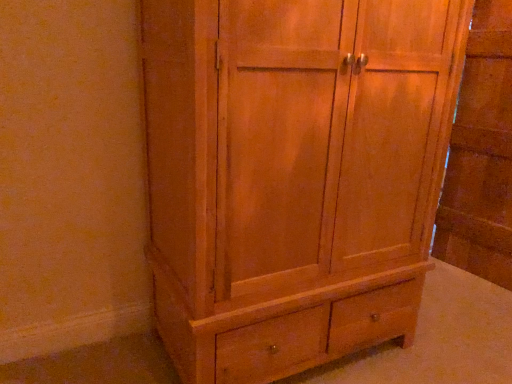
Describe the element at coordinates (481, 154) in the screenshot. I see `natural wood cabinet at right` at that location.

This screenshot has width=512, height=384. I want to click on natural wood cabinet at right, so click(x=481, y=154).

What do you see at coordinates (293, 175) in the screenshot? The width and height of the screenshot is (512, 384). I see `natural wood cupboard at center` at bounding box center [293, 175].

Identify the location of natural wood cupboard at center. The width and height of the screenshot is (512, 384). (293, 175).

At what (x,y) coordinates should I click in order to perform the action: click on natural wood cabinet at right. Please return your answer as a coordinate pair (x, y). Looking at the image, I should click on (481, 154).

Would you say natural wood cupboard at center is to the left or to the right of natural wood cabinet at right in the picture?

From the image, it's evident that natural wood cupboard at center is to the left of natural wood cabinet at right.

Which object is further away from the camera, natural wood cupboard at center or natural wood cabinet at right?

Positioned behind is natural wood cabinet at right.

Which is behind, point (251, 219) or point (466, 83)?

The point (466, 83) is behind.

From the image's perspective, who appears lower, natural wood cupboard at center or natural wood cabinet at right?

From the image's view, natural wood cupboard at center is below.

Based on the photo, from a real-world perspective, is natural wood cupboard at center positioned over natural wood cabinet at right based on gravity?

No.

In terms of width, does natural wood cupboard at center look wider or thinner when compared to natural wood cabinet at right?

Considering their sizes, natural wood cupboard at center looks broader than natural wood cabinet at right.

In terms of height, does natural wood cupboard at center look taller or shorter compared to natural wood cabinet at right?

In the image, natural wood cupboard at center appears to be shorter than natural wood cabinet at right.

Based on their sizes in the image, would you say natural wood cupboard at center is bigger or smaller than natural wood cabinet at right?

Clearly, natural wood cupboard at center is larger in size than natural wood cabinet at right.

Would you say natural wood cupboard at center is outside natural wood cabinet at right?

Yes, natural wood cupboard at center is located beyond the bounds of natural wood cabinet at right.

Is natural wood cupboard at center next to natural wood cabinet at right?

natural wood cupboard at center is not next to natural wood cabinet at right, and they're not touching.

Does natural wood cupboard at center turn towards natural wood cabinet at right?

No.

Locate an element on the screen. side cabinet lying on the right of natural wood cupboard at center is located at coordinates (481, 154).

Consider the image. Is natural wood cabinet at right to the right of natural wood cupboard at center from the viewer's perspective?

Correct, you'll find natural wood cabinet at right to the right of natural wood cupboard at center.

Consider the image. Does natural wood cabinet at right lie in front of natural wood cupboard at center?

No, natural wood cabinet at right is further to the viewer.

Which is behind, point (490, 86) or point (422, 107)?

The point (490, 86) is behind.

From the image's perspective, which one is positioned lower, natural wood cabinet at right or natural wood cupboard at center?

From the image's view, natural wood cupboard at center is below.

From a real-world perspective, is natural wood cabinet at right located beneath natural wood cupboard at center?

Actually, natural wood cabinet at right is physically above natural wood cupboard at center in the real world.

Can you confirm if natural wood cabinet at right is wider than natural wood cupboard at center?

No.

Who is shorter, natural wood cabinet at right or natural wood cupboard at center?

natural wood cupboard at center.

Considering the sizes of objects natural wood cabinet at right and natural wood cupboard at center in the image provided, who is bigger, natural wood cabinet at right or natural wood cupboard at center?

Bigger between the two is natural wood cupboard at center.

Choose the correct answer: Is natural wood cabinet at right inside natural wood cupboard at center or outside it?

natural wood cabinet at right exists outside the volume of natural wood cupboard at center.

Would you say natural wood cabinet at right is a long distance from natural wood cupboard at center?

Yes.

Is natural wood cabinet at right facing towards natural wood cupboard at center?

Yes, natural wood cabinet at right faces towards natural wood cupboard at center.

Measure the distance from natural wood cabinet at right to natural wood cupboard at center.

natural wood cabinet at right and natural wood cupboard at center are 4.15 feet apart from each other.

You are a GUI agent. You are given a task and a screenshot of the screen. Output one action in this format:
    pyautogui.click(x=<x>, y=<y>)
    Task: Click on the cupboard that is in front of the natural wood cabinet at right
    This screenshot has width=512, height=384.
    Given the screenshot: What is the action you would take?
    pyautogui.click(x=293, y=175)

You are a GUI agent. You are given a task and a screenshot of the screen. Output one action in this format:
    pyautogui.click(x=<x>, y=<y>)
    Task: Click on the cupboard below the natural wood cabinet at right (from the image's perspective)
    The height and width of the screenshot is (384, 512).
    Given the screenshot: What is the action you would take?
    pyautogui.click(x=293, y=175)

Locate an element on the screen. cupboard on the left of the natural wood cabinet at right is located at coordinates (293, 175).